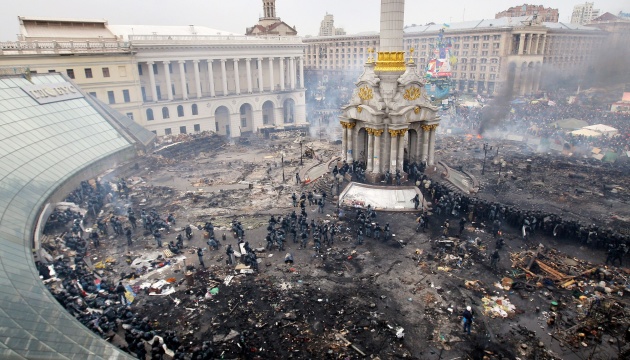
Where is `stairs`? This screenshot has height=360, width=630. stairs is located at coordinates (448, 184), (324, 188).